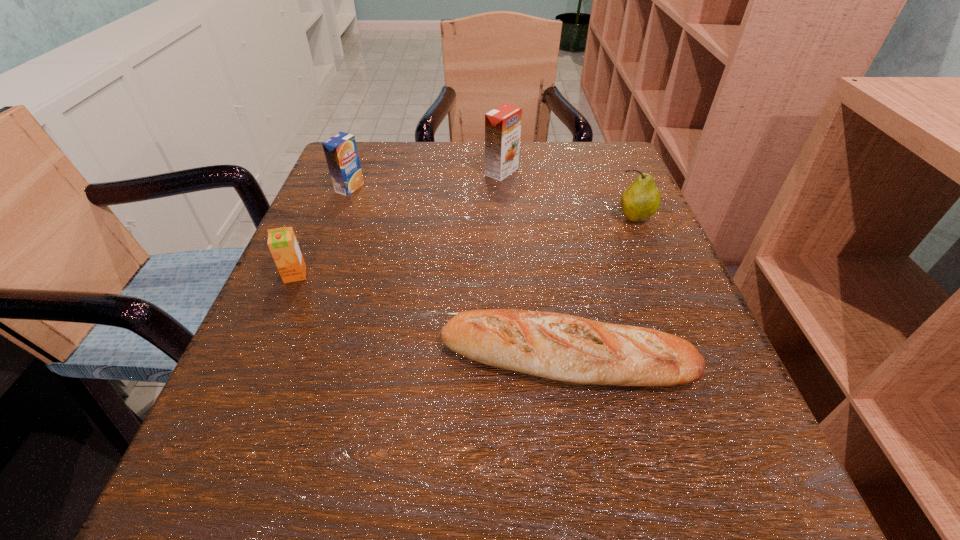
In order to click on the tallest object in this screenshot , I will do `click(503, 124)`.

Where is `the rightmost orange juice`? This screenshot has height=540, width=960. the rightmost orange juice is located at coordinates (503, 124).

Find the location of a particular element. This screenshot has height=540, width=960. pear is located at coordinates (642, 198).

The height and width of the screenshot is (540, 960). In order to click on the second nearest object in this screenshot , I will do `click(282, 242)`.

Where is `baguet`? baguet is located at coordinates pos(551,345).

Where is `the shortest object`? The image size is (960, 540). the shortest object is located at coordinates (551, 345).

I want to click on free space located on the right of the tallest orange juice, so click(555, 172).

You are a GUI agent. You are given a task and a screenshot of the screen. Output one action in this format:
    pyautogui.click(x=<x>, y=<y>)
    Task: Click on the free space located on the left of the third nearest object
    The height and width of the screenshot is (540, 960).
    Given the screenshot: What is the action you would take?
    pyautogui.click(x=485, y=218)

The image size is (960, 540). What are the coordinates of `free region located 0.260m on the back of the nearest orange juice` in the screenshot? It's located at (335, 184).

The image size is (960, 540). In order to click on free space located on the back of the shortest object in this screenshot , I will do `click(539, 199)`.